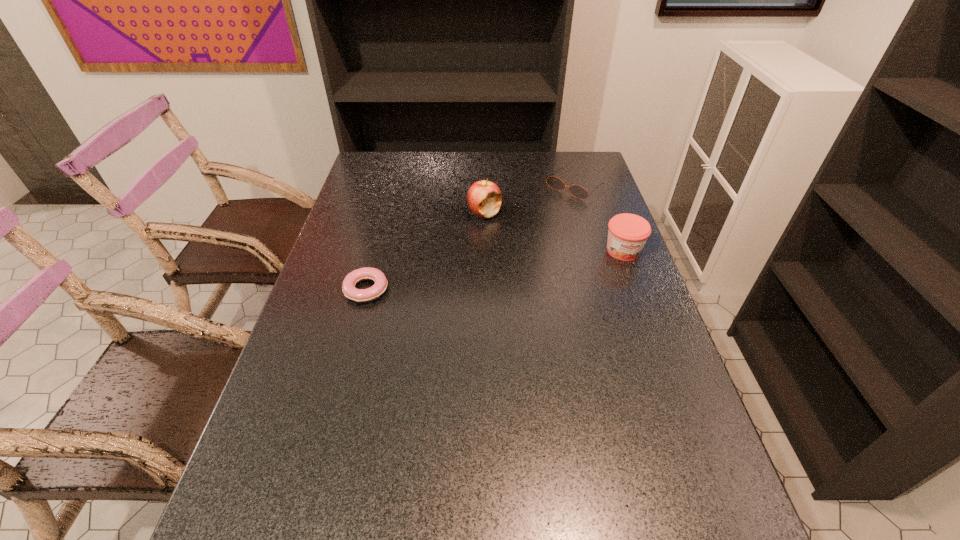
Locate an element on the screen. The image size is (960, 540). object that is at the far right corner is located at coordinates tap(577, 191).

Image resolution: width=960 pixels, height=540 pixels. I want to click on free region at the far edge of the desktop, so click(x=455, y=160).

Identify the location of vacant space at the left edge of the desktop. This screenshot has height=540, width=960. (305, 342).

Where is `vacant space at the right edge of the desktop`? This screenshot has width=960, height=540. vacant space at the right edge of the desktop is located at coordinates (688, 426).

I want to click on free region at the far left corner, so click(x=390, y=153).

Where is `empty location between the second shortest object and the tallest object`? The height and width of the screenshot is (540, 960). empty location between the second shortest object and the tallest object is located at coordinates (529, 200).

Identify the location of vacant space in between the second farthest object and the shortest object. The width and height of the screenshot is (960, 540). (425, 251).

The width and height of the screenshot is (960, 540). In order to click on free point between the shortest object and the farthest object in this screenshot , I will do `click(470, 238)`.

At what (x,y) coordinates should I click in order to perform the action: click on blank region between the apple and the second tallest object. Please return your answer as a coordinate pair (x, y). Image resolution: width=960 pixels, height=540 pixels. Looking at the image, I should click on (554, 232).

At what (x,y) coordinates should I click in order to perform the action: click on free point between the second shortest object and the shortest object. Please return your answer as a coordinate pair (x, y). The width and height of the screenshot is (960, 540). Looking at the image, I should click on (470, 238).